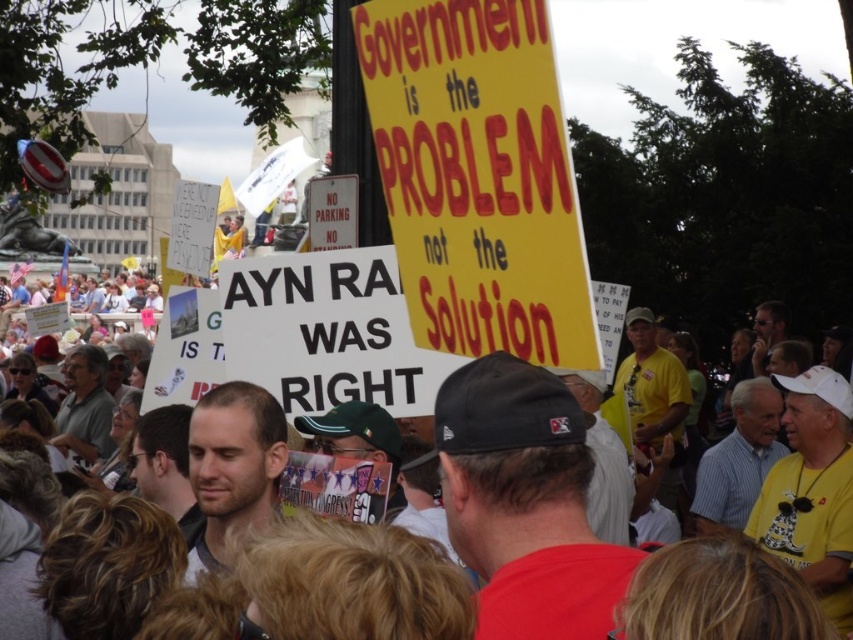
Is yellow t-shirt at center behind smooth skin face at center?

Yes, it is behind smooth skin face at center.

Can you confirm if yellow t-shirt at center is bigger than smooth skin face at center?

Yes.

Which is behind, point (631, 420) or point (189, 488)?

Positioned behind is point (631, 420).

This screenshot has height=640, width=853. Find the location of `yellow t-shirt at center`. yellow t-shirt at center is located at coordinates (653, 396).

Is point (198, 449) more distant than point (651, 419)?

No, (198, 449) is in front of (651, 419).

Is light brown hair at center smaller than yellow t-shirt at center?

Indeed, light brown hair at center has a smaller size compared to yellow t-shirt at center.

Identify the location of light brown hair at center. Image resolution: width=853 pixels, height=640 pixels. pyautogui.click(x=231, y=465).

Does yellow t-shirt at lower right have a smaller size compared to smooth skin face at center?

Incorrect, yellow t-shirt at lower right is not smaller in size than smooth skin face at center.

Is point (834, 380) closer to camera compared to point (142, 451)?

No, (834, 380) is behind (142, 451).

At what (x,y) coordinates should I click in order to perform the action: click on yellow t-shirt at lower right. Please return your answer as a coordinate pair (x, y). Looking at the image, I should click on (811, 490).